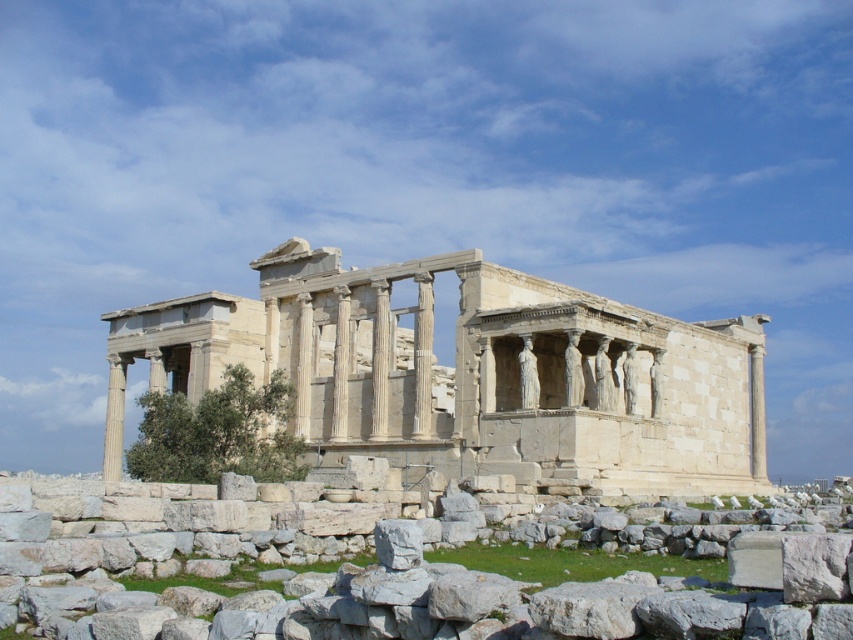
You are a tourist standing in front of the Erechtheion temple. You notice two objects in the scene described as the white stone ruins at center and the white stone at center. Which one is positioned further away from your current viewpoint?

The white stone at center is positioned further away from your viewpoint because it is described as being behind the white stone ruins at center.

You are standing on the ground level looking at the white stone ruins at center and the white stone at center. Which one is higher up from the ground?

The white stone ruins at center is located above the white stone at center, so it is higher up from the ground.